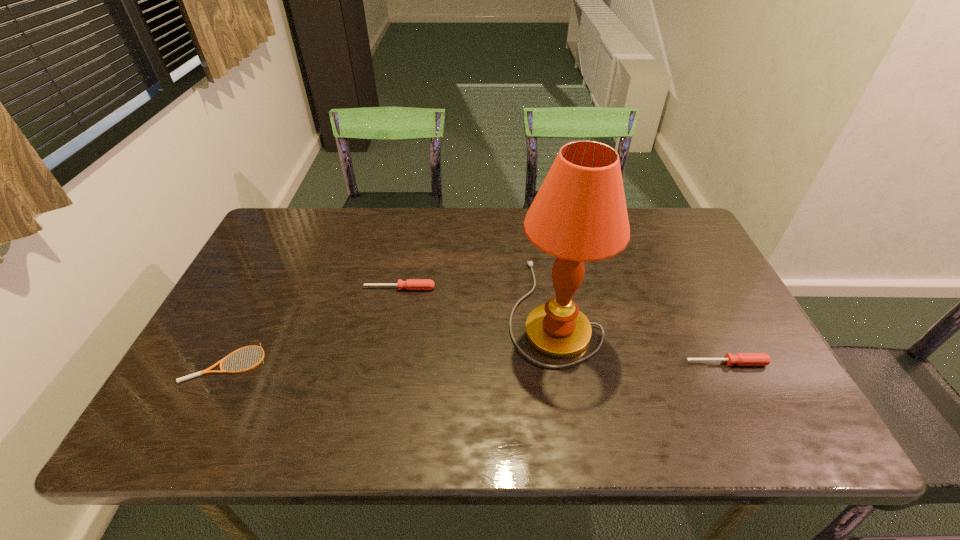
Where is `free space between the nearer screwdriver and the leftmost object`? Image resolution: width=960 pixels, height=540 pixels. free space between the nearer screwdriver and the leftmost object is located at coordinates (476, 363).

Find the location of a particular element. The width and height of the screenshot is (960, 540). empty space between the lamp and the second object from left to right is located at coordinates [476, 299].

This screenshot has height=540, width=960. In order to click on free space between the leftmost object and the rightmost object in this screenshot , I will do `click(476, 363)`.

What are the coordinates of `vacant space in between the shortest object and the farther screwdriver` in the screenshot? It's located at click(x=313, y=326).

At what (x,y) coordinates should I click in order to perform the action: click on vacant area between the shortest object and the left screwdriver. Please return your answer as a coordinate pair (x, y). This screenshot has width=960, height=540. Looking at the image, I should click on (313, 326).

Identify the location of object that is the closest to the rightmost object. The width and height of the screenshot is (960, 540). tap(579, 214).

This screenshot has width=960, height=540. I want to click on the third closest object relative to the shortest object, so click(x=741, y=359).

Where is `free space that satisfies the following two spatial constraints: 1. on the front side of the tallest object; 2. on the left side of the left screwdriver`? Image resolution: width=960 pixels, height=540 pixels. free space that satisfies the following two spatial constraints: 1. on the front side of the tallest object; 2. on the left side of the left screwdriver is located at coordinates (396, 309).

Where is `vacant space that satisfies the following two spatial constraints: 1. on the front side of the second object from right to left; 2. on the left side of the nearer screwdriver`? The width and height of the screenshot is (960, 540). vacant space that satisfies the following two spatial constraints: 1. on the front side of the second object from right to left; 2. on the left side of the nearer screwdriver is located at coordinates (562, 363).

Where is `free location that satisfies the following two spatial constraints: 1. on the back side of the tallest object; 2. on the left side of the shortest object`? The width and height of the screenshot is (960, 540). free location that satisfies the following two spatial constraints: 1. on the back side of the tallest object; 2. on the left side of the shortest object is located at coordinates (254, 309).